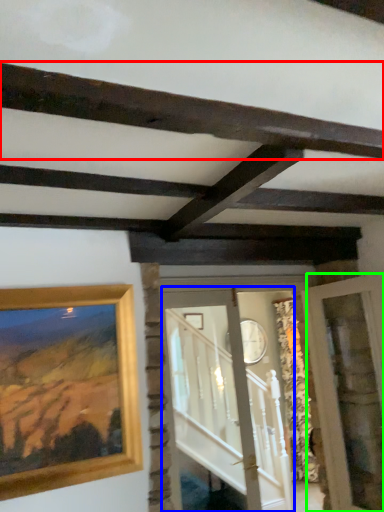
Question: Which is nearer to the plank (highlighted by a red box)? glass door (highlighted by a blue box) or glass door (highlighted by a green box).

Choices:
 (A) glass door
 (B) glass door

Answer: (B)